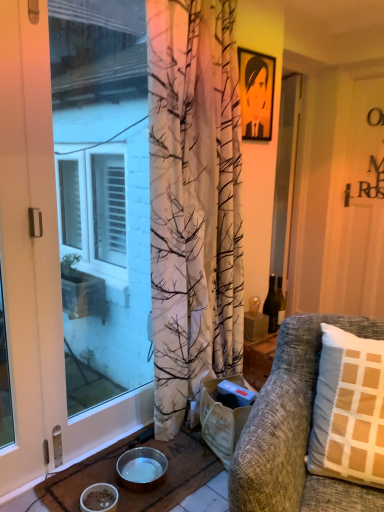
Question: From the image's perspective, is white matte bowl at lower left, which appears as the 1th bowl when viewed from the front, under translucent glass bottle at center right?

Choices:
 (A) no
 (B) yes

Answer: (B)

Question: Is the position of white matte bowl at lower left, which appears as the 1th bowl when viewed from the front, more distant than that of translucent glass bottle at center right?

Choices:
 (A) no
 (B) yes

Answer: (A)

Question: Can you confirm if white matte bowl at lower left, which appears as the 1th bowl when viewed from the front, is positioned to the right of translucent glass bottle at center right?

Choices:
 (A) no
 (B) yes

Answer: (A)

Question: Is white matte bowl at lower left, which appears as the 1th bowl when viewed from the front, facing away from translucent glass bottle at center right?

Choices:
 (A) no
 (B) yes

Answer: (A)

Question: Can you confirm if white matte bowl at lower left, which appears as the 1th bowl when viewed from the front, is taller than translucent glass bottle at center right?

Choices:
 (A) yes
 (B) no

Answer: (B)

Question: From their relative heights in the image, would you say textured gray couch at right is taller or shorter than transparent glass screen door at center, which is the 1th screen door from back to front?

Choices:
 (A) short
 (B) tall

Answer: (A)

Question: From a real-world perspective, is textured gray couch at right physically located above or below transparent glass screen door at center, positioned as the second screen door in front-to-back order?

Choices:
 (A) above
 (B) below

Answer: (B)

Question: Is textured gray couch at right situated inside transparent glass screen door at center, placed as the 2th screen door when sorted from left to right, or outside?

Choices:
 (A) outside
 (B) inside

Answer: (A)

Question: Is point (297, 502) positioned closer to the camera than point (276, 260)?

Choices:
 (A) closer
 (B) farther

Answer: (A)

Question: Considering the relative positions of translucent glass bottle at center right and transparent glass screen door at center, positioned as the second screen door in front-to-back order, in the image provided, is translucent glass bottle at center right to the left or to the right of transparent glass screen door at center, positioned as the second screen door in front-to-back order,?

Choices:
 (A) left
 (B) right

Answer: (A)

Question: Is translucent glass bottle at center right wider or thinner than transparent glass screen door at center, positioned as the second screen door in front-to-back order?

Choices:
 (A) wide
 (B) thin

Answer: (A)

Question: Is translucent glass bottle at center right inside or outside of transparent glass screen door at center, the first screen door viewed from the right?

Choices:
 (A) outside
 (B) inside

Answer: (A)

Question: Is point (271, 279) closer or farther from the camera than point (284, 81)?

Choices:
 (A) farther
 (B) closer

Answer: (B)

Question: Does point (276, 313) appear closer or farther from the camera than point (312, 477)?

Choices:
 (A) closer
 (B) farther

Answer: (B)

Question: From the image's perspective, is translucent glass bottle at center right located above or below textured gray couch at right?

Choices:
 (A) above
 (B) below

Answer: (A)